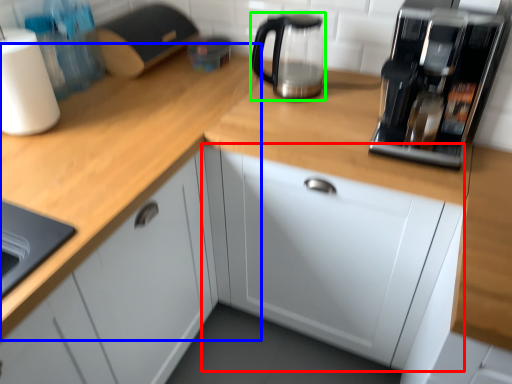
Question: Which object is the closest to the cabinetry (highlighted by a red box)? Choose among these: countertop (highlighted by a blue box) or kitchen appliance (highlighted by a green box).

Choices:
 (A) countertop
 (B) kitchen appliance

Answer: (A)